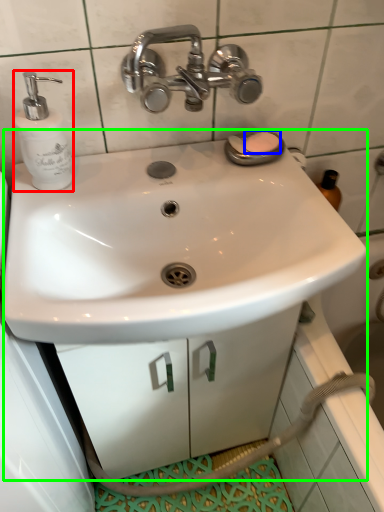
Question: Based on their relative distances, which object is farther from soap dispenser (highlighted by a red box)? Choose from soap (highlighted by a blue box) and sink (highlighted by a green box).

Choices:
 (A) soap
 (B) sink

Answer: (B)